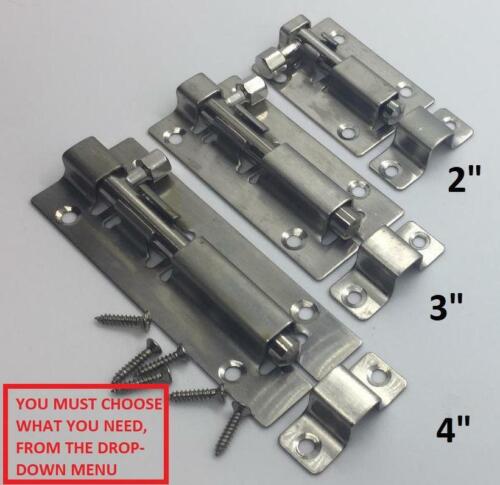
You are a GUI agent. You are given a task and a screenshot of the screen. Output one action in this format:
    pyautogui.click(x=<x>, y=<y>)
    Task: Click on the screws
    Image resolution: width=500 pixels, height=485 pixels.
    Given the screenshot: What is the action you would take?
    pyautogui.click(x=200, y=391), pyautogui.click(x=240, y=415), pyautogui.click(x=147, y=373), pyautogui.click(x=155, y=363), pyautogui.click(x=147, y=351), pyautogui.click(x=144, y=322)